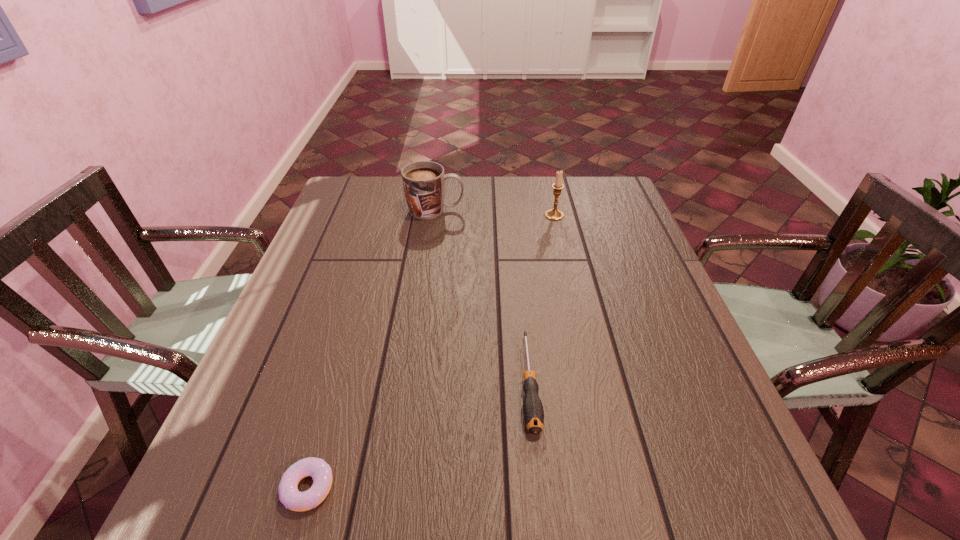
Locate an element on the screen. The height and width of the screenshot is (540, 960). free spot between the screwdriver and the second object from left to right is located at coordinates (482, 296).

Identify which object is the closest to the candle holder. Please provide its 2D coordinates. Your answer should be formatted as a tuple, i.e. [(x, y)], where the tuple contains the x and y coordinates of a point satisfying the conditions above.

[(424, 181)]

Locate which object ranks second in proximity to the third object from left to right. Please provide its 2D coordinates. Your answer should be formatted as a tuple, i.e. [(x, y)], where the tuple contains the x and y coordinates of a point satisfying the conditions above.

[(553, 214)]

Where is `vacant space that satisfies the following two spatial constraints: 1. on the back side of the doughnut; 2. on the left side of the rightmost object`? The width and height of the screenshot is (960, 540). vacant space that satisfies the following two spatial constraints: 1. on the back side of the doughnut; 2. on the left side of the rightmost object is located at coordinates (387, 215).

This screenshot has width=960, height=540. I want to click on free space that satisfies the following two spatial constraints: 1. on the side of the mug with the handle; 2. on the front side of the leftmost object, so click(x=396, y=488).

Locate an element on the screen. The width and height of the screenshot is (960, 540). free space that satisfies the following two spatial constraints: 1. on the back side of the candle holder; 2. on the left side of the third farthest object is located at coordinates (513, 215).

At what (x,y) coordinates should I click in order to perform the action: click on free point that satisfies the following two spatial constraints: 1. on the side of the third object from right to left with the handle; 2. on the left side of the second object from right to left. Please return your answer as a coordinate pair (x, y). Looking at the image, I should click on (411, 382).

Where is `free location that satisfies the following two spatial constraints: 1. on the back side of the screwdriver; 2. on the left side of the nearest object`? This screenshot has height=540, width=960. free location that satisfies the following two spatial constraints: 1. on the back side of the screwdriver; 2. on the left side of the nearest object is located at coordinates (339, 382).

Identify the location of free location that satisfies the following two spatial constraints: 1. on the back side of the screwdriver; 2. on the side of the second object from left to right with the handle. pyautogui.click(x=512, y=210).

Find the location of a particular element. The height and width of the screenshot is (540, 960). vacant area in the image that satisfies the following two spatial constraints: 1. on the side of the third object from left to right with the handle; 2. on the left side of the third object from right to left is located at coordinates (411, 382).